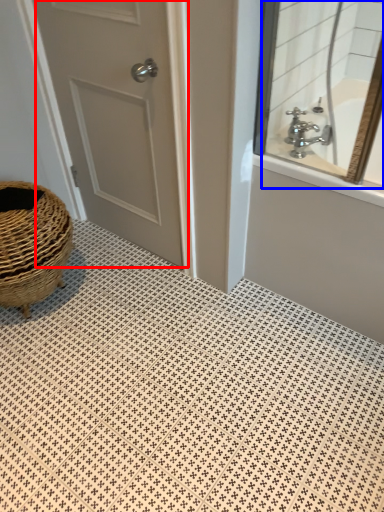
Question: Among these objects, which one is farthest to the camera, door (highlighted by a red box) or mirror (highlighted by a blue box)?

Choices:
 (A) door
 (B) mirror

Answer: (B)